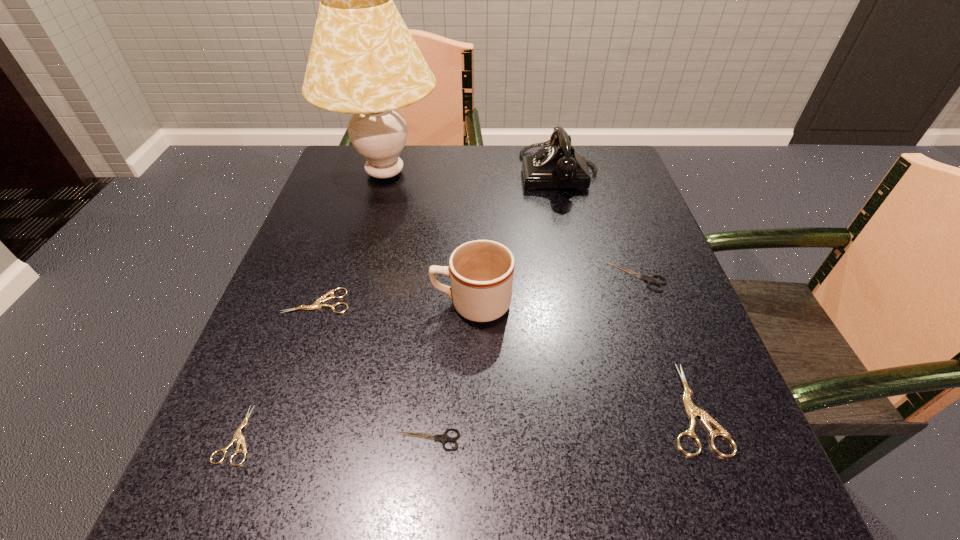
This screenshot has height=540, width=960. Find the location of `vacant space located 0.150m on the back of the second biggest beige shears`. vacant space located 0.150m on the back of the second biggest beige shears is located at coordinates (340, 238).

The image size is (960, 540). What are the coordinates of `free space located 0.050m on the left of the smaller black shears` in the screenshot? It's located at (359, 440).

Find the location of a particular element. The width and height of the screenshot is (960, 540). free space located 0.120m on the right of the shortest shears is located at coordinates (339, 435).

At what (x,y) coordinates should I click in order to perform the action: click on lampshade positioned at the far edge. Please return your answer as a coordinate pair (x, y). The image size is (960, 540). Looking at the image, I should click on (363, 61).

Locate an element on the screen. This screenshot has height=540, width=960. telephone that is at the far edge is located at coordinates (558, 165).

This screenshot has height=540, width=960. I want to click on object that is at the near edge, so click(238, 436).

This screenshot has width=960, height=540. Find the location of `lampshade that is at the left edge`. lampshade that is at the left edge is located at coordinates (363, 61).

The width and height of the screenshot is (960, 540). In order to click on telephone that is at the right edge in this screenshot , I will do `click(558, 165)`.

You are a GUI agent. You are given a task and a screenshot of the screen. Output one action in this format:
    pyautogui.click(x=<x>, y=<y>)
    Task: Click on the object that is at the far left corner
    
    Given the screenshot: What is the action you would take?
    pyautogui.click(x=363, y=61)

The image size is (960, 540). In order to click on object located in the near left corner section of the desktop in this screenshot , I will do `click(238, 436)`.